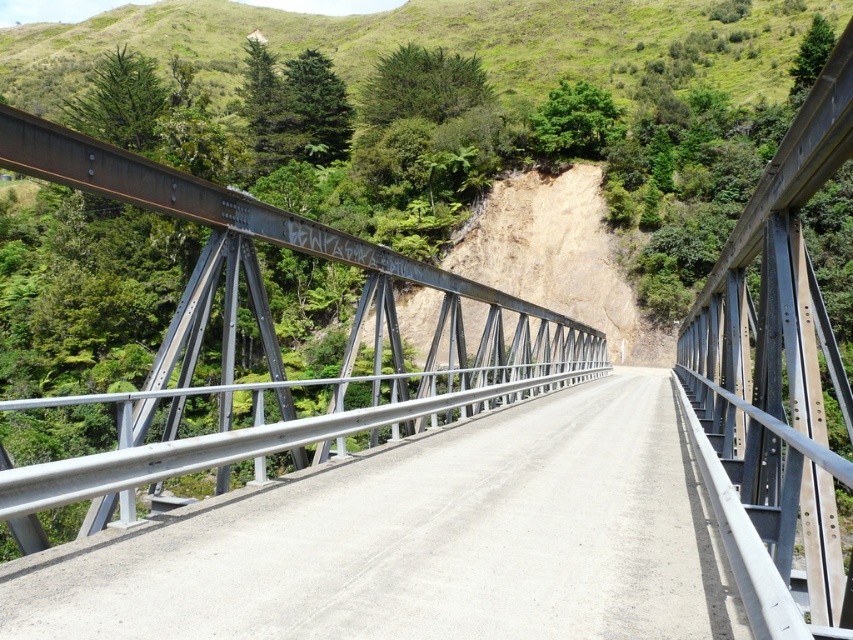
You are a cyclist approaching the bridge and need to decide which side to ride on. The smooth concrete road at center and the metallic gray bridge at center are both present. Which one is on the right side of the other?

The smooth concrete road at center is positioned on the right side of the metallic gray bridge at center, so the smooth concrete road at center is to the right of the metallic gray bridge at center.

You are standing on the metallic gray bridge at center and want to take a photo of the green grassy hillside at upper center. Which direction should you face to capture the hillside in your view?

You should face to the left because the metallic gray bridge at center is to the right of the green grassy hillside at upper center, so facing left will bring the hillside into view.